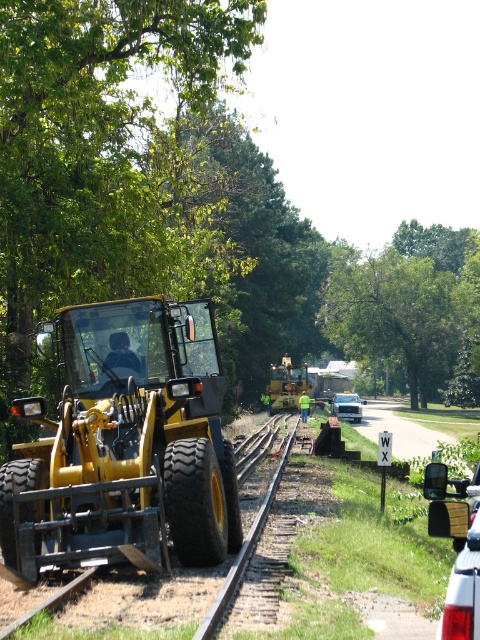
You are a railway inspector checking the scene. You need to determine if the green leafy tree at center and yellow rubber tractor at center can be moved closer together so that they occupy the same space. Based on their widths, is this possible?

The green leafy tree at center is wider than the yellow rubber tractor at center. Since they cannot occupy the same space if one is wider than the other, moving them closer to occupy the same space is not possible.

You are a railway inspector checking the area around the tracks. You notice the green leafy tree at left and the yellow rubber tractor at center. Which object is taller?

The green leafy tree at left is much taller than the yellow rubber tractor at center.

Based on the scene description, can you determine which object is wider between the green leafy tree at left and the yellow rubber train track at center?

The green leafy tree at left is wider than the yellow rubber train track at center according to the description.